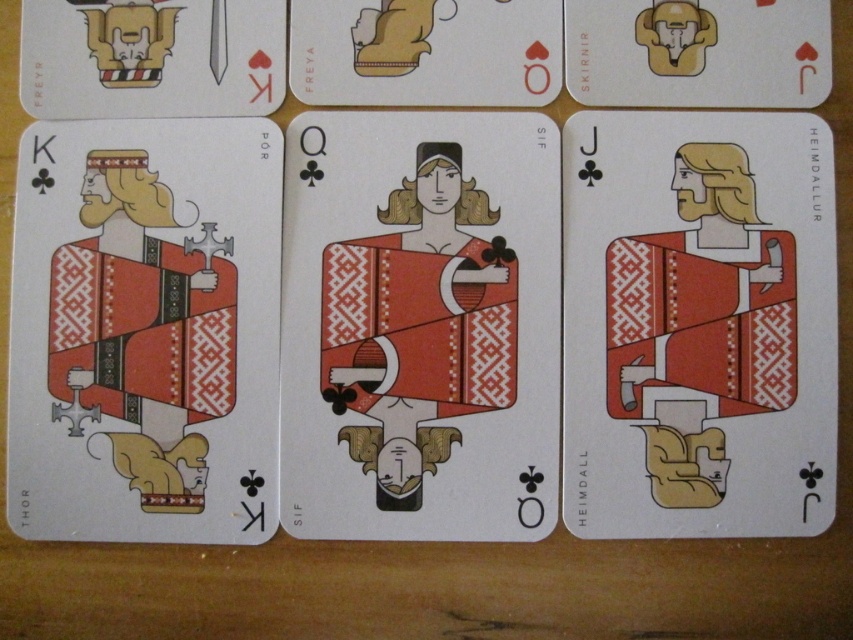
You are a card player who wants to place a new card between the matte red dress at center and the matte red fabric king at left. The new card is 1.5 inches wide. Can you fit it between them without overlapping?

The distance between the matte red dress at center and the matte red fabric king at left is 3.02 inches. Since the new card is only 1.5 inches wide, there is enough space to place it between them without overlapping.

In the scene shown: You are arranging a display of Nordic themed playing cards on a shelf. You have a matte red card at right and a matte red fabric king at left. According to the arrangement shown in the image, which object is positioned to the right of the other?

The matte red card at right is positioned to the right of the matte red fabric king at left.

You are a game designer creating a card game. You have two cards in front of you, the matte red dress at center and the matte red fabric king at left. Which card is closer to the viewer?

The matte red dress at center is closer to the viewer because the matte red fabric king at left is behind it.